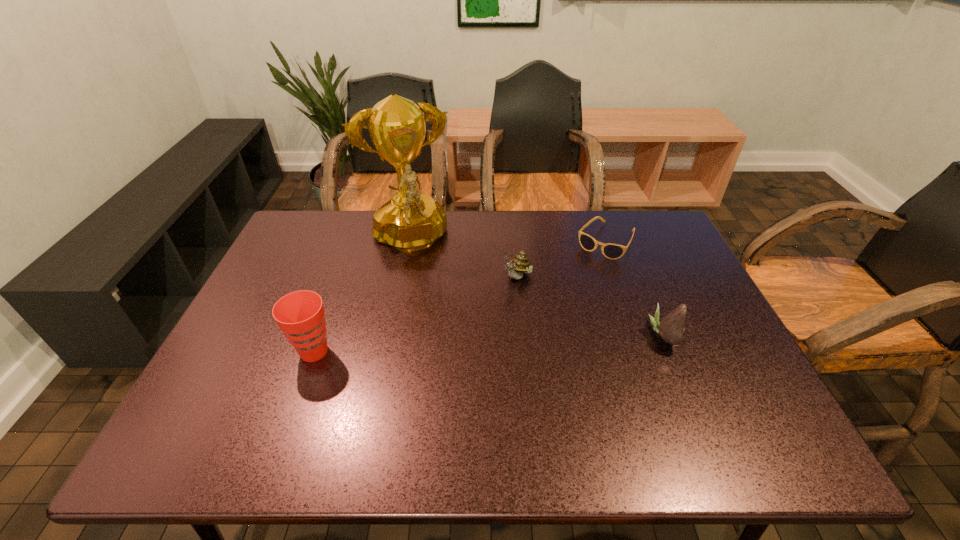
This screenshot has width=960, height=540. Identify the location of free spot on the desktop that is between the cup and the avocado and is positioned on the front side of the tallest object. (444, 346).

Locate an element on the screen. This screenshot has height=540, width=960. vacant space on the desktop that is between the fourth shortest object and the avocado and is positioned on the front-facing side of the shortest object is located at coordinates (530, 341).

The height and width of the screenshot is (540, 960). Identify the location of vacant space on the desktop that is between the second tallest object and the avocado and is positioned on the face of the third object from left to right. (461, 345).